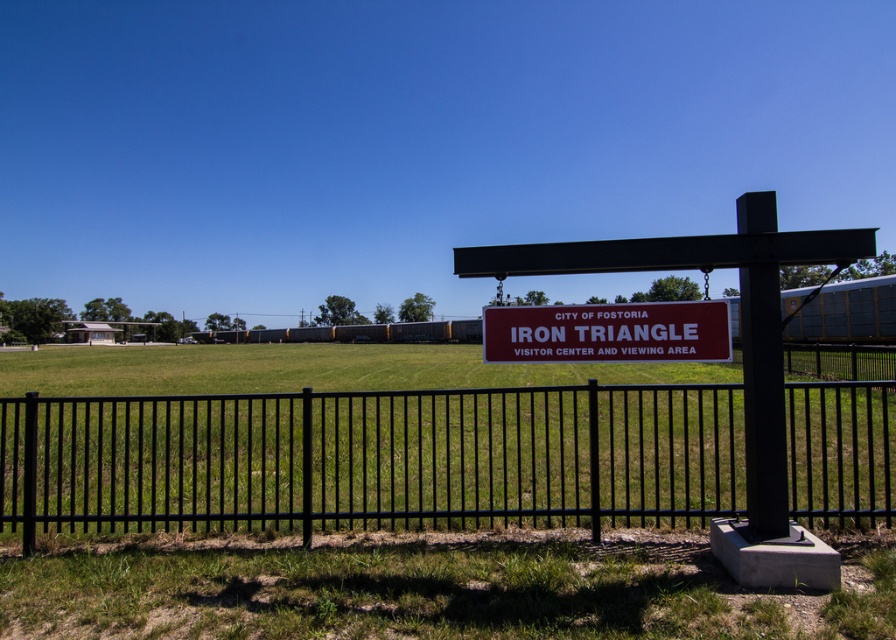
Is point (690, 333) farther from viewer compared to point (203, 337)?

No, (690, 333) is in front of (203, 337).

Is matte red sign at center positioned in front of yellow corrugated metal train at center?

Yes, it is.

Which is in front, point (571, 336) or point (298, 328)?

Point (571, 336) is in front.

Find the location of a particular element. The image size is (896, 640). matte red sign at center is located at coordinates (607, 332).

Who is more distant from viewer, (197, 336) or (843, 282)?

The point (197, 336) is more distant.

Who is more distant from viewer, (x=297, y=332) or (x=738, y=320)?

The point (x=297, y=332) is behind.

Identify the location of yellow corrugated metal train at center. (843, 312).

Which is in front, point (334, 436) or point (866, 296)?

Point (334, 436) is in front.

Does black metal fence at center lie behind yellow corrugated metal train at center?

That is False.

In order to click on black metal fence at center in this screenshot , I will do (x=372, y=458).